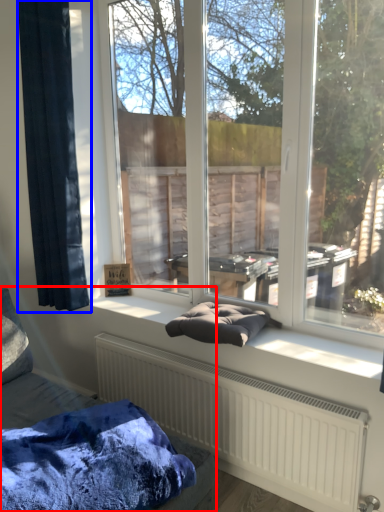
Question: Which object appears closest to the camera in this image, furniture (highlighted by a red box) or curtain (highlighted by a blue box)?

Choices:
 (A) furniture
 (B) curtain

Answer: (A)